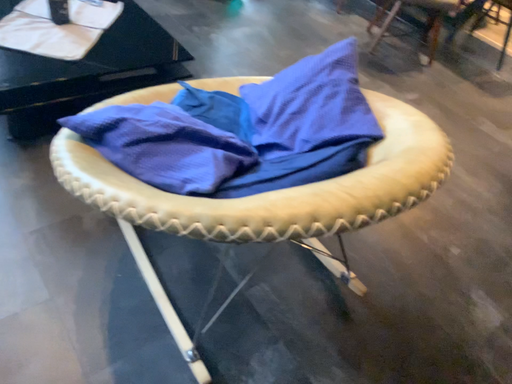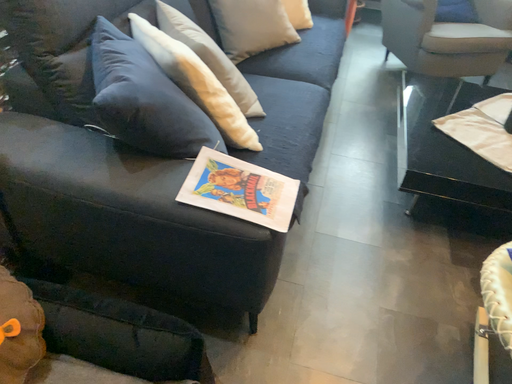
Question: How did the camera likely rotate when shooting the video?

Choices:
 (A) rotated left
 (B) rotated right

Answer: (A)